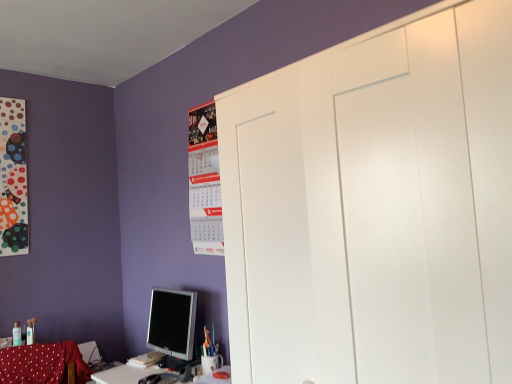
Measure the distance between matte paper calendar at upper center and camera.

A distance of 7.16 feet exists between matte paper calendar at upper center and camera.

You are a GUI agent. You are given a task and a screenshot of the screen. Output one action in this format:
    pyautogui.click(x=<x>, y=<y>)
    Task: Click on the red fabric swivel chair at lower left
    This screenshot has width=512, height=384.
    Given the screenshot: What is the action you would take?
    pyautogui.click(x=42, y=364)

Image resolution: width=512 pixels, height=384 pixels. I want to click on matte paper calendar at upper center, so click(204, 181).

Who is bigger, matte paper calendar at upper center or matte silver monitor at lower left?

matte silver monitor at lower left.

Is matte paper calendar at upper center outside of matte silver monitor at lower left?

matte paper calendar at upper center is positioned outside matte silver monitor at lower left.

Can you confirm if matte paper calendar at upper center is thinner than matte silver monitor at lower left?

Correct, the width of matte paper calendar at upper center is less than that of matte silver monitor at lower left.

Considering the sizes of matte paper calendar at upper center and red fabric swivel chair at lower left in the image, is matte paper calendar at upper center taller or shorter than red fabric swivel chair at lower left?

Clearly, matte paper calendar at upper center is taller compared to red fabric swivel chair at lower left.

Does matte paper calendar at upper center have a greater width compared to red fabric swivel chair at lower left?

Incorrect, the width of matte paper calendar at upper center does not surpass that of red fabric swivel chair at lower left.

Identify the location of swivel chair on the left of matte paper calendar at upper center. (42, 364).

Considering the relative positions of red fabric swivel chair at lower left and matte paper calendar at upper center in the image provided, is red fabric swivel chair at lower left to the left of matte paper calendar at upper center from the viewer's perspective?

Yes.

Consider the image. How many degrees apart are the facing directions of red fabric swivel chair at lower left and matte paper calendar at upper center?

They differ by 70.4 degrees in their facing directions.

From the image's perspective, is red fabric swivel chair at lower left above or below matte paper calendar at upper center?

red fabric swivel chair at lower left is below matte paper calendar at upper center.

Could you tell me if red fabric swivel chair at lower left is turned towards matte silver monitor at lower left?

No, red fabric swivel chair at lower left is not turned towards matte silver monitor at lower left.

From a real-world perspective, who is located higher, red fabric swivel chair at lower left or matte silver monitor at lower left?

matte silver monitor at lower left.

Between red fabric swivel chair at lower left and matte silver monitor at lower left, which one has larger width?

Wider between the two is matte silver monitor at lower left.

Considering the sizes of red fabric swivel chair at lower left and matte silver monitor at lower left in the image, is red fabric swivel chair at lower left taller or shorter than matte silver monitor at lower left?

In the image, red fabric swivel chair at lower left appears to be shorter than matte silver monitor at lower left.

Could you tell me if matte silver monitor at lower left is facing matte paper calendar at upper center?

No, matte silver monitor at lower left is not aimed at matte paper calendar at upper center.

Looking at their sizes, would you say matte silver monitor at lower left is wider or thinner than matte paper calendar at upper center?

matte silver monitor at lower left is wider than matte paper calendar at upper center.

Is point (169, 329) in front of point (213, 118)?

That is True.

Is matte silver monitor at lower left smaller than red fabric swivel chair at lower left?

Actually, matte silver monitor at lower left might be larger than red fabric swivel chair at lower left.

Is the surface of matte silver monitor at lower left in direct contact with red fabric swivel chair at lower left?

No, matte silver monitor at lower left is not beside red fabric swivel chair at lower left.

Is matte silver monitor at lower left in front of red fabric swivel chair at lower left?

No, the depth of matte silver monitor at lower left is greater than that of red fabric swivel chair at lower left.

Is matte silver monitor at lower left aimed at red fabric swivel chair at lower left?

Yes, matte silver monitor at lower left faces towards red fabric swivel chair at lower left.

Locate an element on the screen. The image size is (512, 384). computer monitor that appears on the left of matte paper calendar at upper center is located at coordinates (172, 322).

At what (x,y) coordinates should I click in order to perform the action: click on bulletin board located behind the red fabric swivel chair at lower left. Please return your answer as a coordinate pair (x, y). Image resolution: width=512 pixels, height=384 pixels. Looking at the image, I should click on (204, 181).

Estimate the real-world distances between objects in this image. Which object is closer to red fabric swivel chair at lower left, matte silver monitor at lower left or matte paper calendar at upper center?

The object closer to red fabric swivel chair at lower left is matte silver monitor at lower left.

Looking at the image, which one is located further to matte silver monitor at lower left, red fabric swivel chair at lower left or matte paper calendar at upper center?

red fabric swivel chair at lower left.

Estimate the real-world distances between objects in this image. Which object is further from matte paper calendar at upper center, matte silver monitor at lower left or red fabric swivel chair at lower left?

The object further to matte paper calendar at upper center is red fabric swivel chair at lower left.

Considering their positions, is matte paper calendar at upper center positioned closer to matte silver monitor at lower left than red fabric swivel chair at lower left?

The object closer to matte silver monitor at lower left is matte paper calendar at upper center.

Considering their positions, is matte paper calendar at upper center positioned closer to red fabric swivel chair at lower left than matte silver monitor at lower left?

matte silver monitor at lower left is positioned closer to the anchor red fabric swivel chair at lower left.

Based on their spatial positions, is red fabric swivel chair at lower left or matte silver monitor at lower left further from matte paper calendar at upper center?

red fabric swivel chair at lower left lies further to matte paper calendar at upper center than the other object.

Locate an element on the screen. The height and width of the screenshot is (384, 512). computer monitor that lies between matte paper calendar at upper center and red fabric swivel chair at lower left from top to bottom is located at coordinates (172, 322).